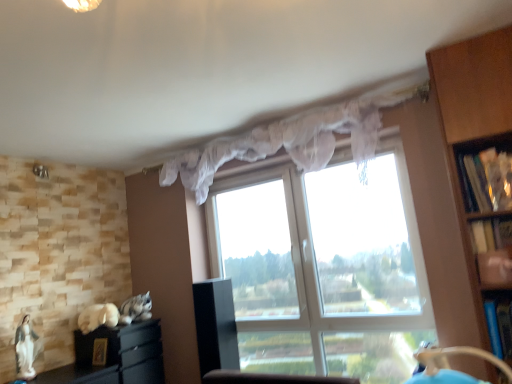
In order to face translucent fabric curtain at upper center, should I rotate leftwards or rightwards?

To align with it, rotate right about 0.863°.

This screenshot has height=384, width=512. Describe the element at coordinates (125, 350) in the screenshot. I see `black matte cabinet at lower left, the 1th cabinetry from the left` at that location.

What do you see at coordinates (136, 309) in the screenshot? I see `fluffy gray cat at lower left, arranged as the first animal when viewed from the right` at bounding box center [136, 309].

This screenshot has width=512, height=384. I want to click on white fur cat at lower left, which is the 1th animal from left to right, so click(x=98, y=317).

What do you see at coordinates (495, 267) in the screenshot? I see `wooden bookshelf at right, which is counted as the 2th shelf, starting from the top` at bounding box center [495, 267].

Locate an element on the screen. This screenshot has height=384, width=512. black glossy cabinet at center, the second cabinetry in the left-to-right sequence is located at coordinates (215, 325).

Does blue plastic shelf at right, positioned as the third shelf in top-to-bottom order, turn towards translucent fabric curtain at upper center?

No, blue plastic shelf at right, positioned as the third shelf in top-to-bottom order, is not aimed at translucent fabric curtain at upper center.

Is point (503, 332) positioned after point (205, 193)?

No.

From a real-world perspective, which object stands above the other?

From a 3D spatial view, translucent fabric curtain at upper center is above.

Which is less distant, (490, 333) or (362, 276)?

Point (490, 333) is closer to the camera than point (362, 276).

Does blue plastic shelf at right, which is counted as the 1th shelf, starting from the bottom, appear on the right side of transparent fabric window at center?

Indeed, blue plastic shelf at right, which is counted as the 1th shelf, starting from the bottom, is positioned on the right side of transparent fabric window at center.

Who is bigger, blue plastic shelf at right, which is counted as the 1th shelf, starting from the bottom, or transparent fabric window at center?

transparent fabric window at center.

How different are the orientations of blue plastic shelf at right, positioned as the third shelf in top-to-bottom order, and transparent fabric window at center in degrees?

1.2 degrees separate the facing orientations of blue plastic shelf at right, positioned as the third shelf in top-to-bottom order, and transparent fabric window at center.

From the image's perspective, would you say translucent fabric curtain at upper center is positioned over wooden bookshelf at right, which appears as the first shelf when viewed from the top?

Yes, from the image's perspective, translucent fabric curtain at upper center is above wooden bookshelf at right, which appears as the first shelf when viewed from the top.

What's the angular difference between translucent fabric curtain at upper center and wooden bookshelf at right, marked as the third shelf in a bottom-to-top arrangement,'s facing directions?

There is a 2.56-degree angle between the facing directions of translucent fabric curtain at upper center and wooden bookshelf at right, marked as the third shelf in a bottom-to-top arrangement.

From a real-world perspective, which is physically above, translucent fabric curtain at upper center or wooden bookshelf at right, marked as the third shelf in a bottom-to-top arrangement?

In real-world perspective, translucent fabric curtain at upper center is above.

The width and height of the screenshot is (512, 384). What are the coordinates of `shelf that is the 1st one when counting downward from the translucent fabric curtain at upper center (from the image's perspective)` in the screenshot? It's located at (490, 234).

From the image's perspective, is wooden bookshelf at right, which appears as the first shelf when viewed from the top, located above translucent fabric curtain at upper center?

No.

Looking at this image, does wooden bookshelf at right, which appears as the first shelf when viewed from the top, have a smaller size compared to translucent fabric curtain at upper center?

Yes, wooden bookshelf at right, which appears as the first shelf when viewed from the top, is smaller than translucent fabric curtain at upper center.

In the scene shown: From a real-world perspective, is wooden bookshelf at right, which appears as the first shelf when viewed from the top, under translucent fabric curtain at upper center?

Yes, from a real-world perspective, wooden bookshelf at right, which appears as the first shelf when viewed from the top, is below translucent fabric curtain at upper center.

Is the position of wooden bookshelf at right, which appears as the first shelf when viewed from the top, more distant than that of translucent fabric curtain at upper center?

No, wooden bookshelf at right, which appears as the first shelf when viewed from the top, is in front of translucent fabric curtain at upper center.

Is wooden bookshelf at right, marked as the third shelf in a bottom-to-top arrangement, touching black glossy cabinet at center, the second cabinetry in the left-to-right sequence?

No, wooden bookshelf at right, marked as the third shelf in a bottom-to-top arrangement, is not making contact with black glossy cabinet at center, the second cabinetry in the left-to-right sequence.

From the image's perspective, is wooden bookshelf at right, marked as the third shelf in a bottom-to-top arrangement, above or below black glossy cabinet at center, the second cabinetry in the left-to-right sequence?

From the image's perspective, wooden bookshelf at right, marked as the third shelf in a bottom-to-top arrangement, appears above black glossy cabinet at center, the second cabinetry in the left-to-right sequence.

From a real-world perspective, which object rests below the other?

black glossy cabinet at center, the second cabinetry in the left-to-right sequence, is physically lower.

Which of these two, wooden bookshelf at right, which appears as the first shelf when viewed from the top, or black glossy cabinet at center, the second cabinetry in the left-to-right sequence, is bigger?

Bigger between the two is black glossy cabinet at center, the second cabinetry in the left-to-right sequence.

Is wooden bookshelf at right, which is counted as the 2th shelf, starting from the top, spatially inside wooden bookshelf at right, marked as the third shelf in a bottom-to-top arrangement, or outside of it?

wooden bookshelf at right, which is counted as the 2th shelf, starting from the top, is located beyond the bounds of wooden bookshelf at right, marked as the third shelf in a bottom-to-top arrangement.

Between wooden bookshelf at right, which is counted as the 2th shelf, starting from the top, and wooden bookshelf at right, which appears as the first shelf when viewed from the top, which one has larger size?

Bigger between the two is wooden bookshelf at right, which appears as the first shelf when viewed from the top.

Between wooden bookshelf at right, the second shelf from the bottom, and wooden bookshelf at right, marked as the third shelf in a bottom-to-top arrangement, which one is positioned in front?

Positioned in front is wooden bookshelf at right, the second shelf from the bottom.

How distant is wooden bookshelf at right, the second shelf from the bottom, from wooden bookshelf at right, which appears as the first shelf when viewed from the top?

The distance of wooden bookshelf at right, the second shelf from the bottom, from wooden bookshelf at right, which appears as the first shelf when viewed from the top, is 5.05 inches.

Considering the points (252, 307) and (355, 139), which point is behind, point (252, 307) or point (355, 139)?

The point (252, 307) is farther from the camera.

Can you confirm if transparent fabric window at center is thinner than translucent fabric curtain at upper center?

No.

Is transparent fabric window at center oriented towards translucent fabric curtain at upper center?

Yes, transparent fabric window at center is oriented towards translucent fabric curtain at upper center.

From a real-world perspective, which is physically below, transparent fabric window at center or translucent fabric curtain at upper center?

transparent fabric window at center, from a real-world perspective.

From a real-world perspective, which shelf is the 3rd one underneath the translucent fabric curtain at upper center? Please provide its 2D coordinates.

[(499, 324)]

In the image, there is a transparent fabric window at center. At what (x,y) coordinates should I click in order to perform the action: click on shelf below it (from the image's perspective). Please return your answer as a coordinate pair (x, y). Looking at the image, I should click on (499, 324).

When comparing their distances from blue plastic shelf at right, positioned as the third shelf in top-to-bottom order, does wooden bookshelf at right, the second shelf from the bottom, or white fur cat at lower left, which is the 1th animal from left to right, seem closer?

wooden bookshelf at right, the second shelf from the bottom, is positioned closer to the anchor blue plastic shelf at right, positioned as the third shelf in top-to-bottom order.

Which object lies nearer to the anchor point black matte cabinet at lower left, the 2th cabinetry from the right, translucent fabric curtain at upper center or transparent fabric window at center?

Among the two, transparent fabric window at center is located nearer to black matte cabinet at lower left, the 2th cabinetry from the right.

Estimate the real-world distances between objects in this image. Which object is closer to wooden bookshelf at right, the second shelf from the bottom, black glossy cabinet at center, the second cabinetry in the left-to-right sequence, or white fur cat at lower left, which is the 1th animal from left to right?

black glossy cabinet at center, the second cabinetry in the left-to-right sequence.

Based on their spatial positions, is fluffy gray cat at lower left, which appears as the 2th animal when viewed from the left, or blue plastic shelf at right, which is counted as the 1th shelf, starting from the bottom, further from wooden bookshelf at right, the second shelf from the bottom?

fluffy gray cat at lower left, which appears as the 2th animal when viewed from the left, is positioned further to the anchor wooden bookshelf at right, the second shelf from the bottom.

Which object lies further to the anchor point black matte cabinet at lower left, the 2th cabinetry from the right, wooden bookshelf at right, which appears as the first shelf when viewed from the top, or translucent fabric curtain at upper center?

Based on the image, wooden bookshelf at right, which appears as the first shelf when viewed from the top, appears to be further to black matte cabinet at lower left, the 2th cabinetry from the right.

Based on their spatial positions, is wooden bookshelf at right, which is counted as the 2th shelf, starting from the top, or translucent fabric curtain at upper center closer to blue plastic shelf at right, which is counted as the 1th shelf, starting from the bottom?

wooden bookshelf at right, which is counted as the 2th shelf, starting from the top.

Based on their spatial positions, is fluffy gray cat at lower left, which appears as the 2th animal when viewed from the left, or wooden bookshelf at right, marked as the third shelf in a bottom-to-top arrangement, further from wooden bookshelf at right, the second shelf from the bottom?

The object further to wooden bookshelf at right, the second shelf from the bottom, is fluffy gray cat at lower left, which appears as the 2th animal when viewed from the left.

Considering their positions, is fluffy gray cat at lower left, arranged as the first animal when viewed from the right, positioned further to transparent fabric window at center than blue plastic shelf at right, positioned as the third shelf in top-to-bottom order?

The object further to transparent fabric window at center is fluffy gray cat at lower left, arranged as the first animal when viewed from the right.

At what (x,y) coordinates should I click in order to perform the action: click on curtain between white fur cat at lower left, which appears as the second animal when viewed from the right, and wooden bookshelf at right, which appears as the first shelf when viewed from the top. Please return your answer as a coordinate pair (x, y). Looking at the image, I should click on (282, 145).

This screenshot has height=384, width=512. I want to click on curtain between white fur cat at lower left, which is the 1th animal from left to right, and wooden bookshelf at right, which is counted as the 2th shelf, starting from the top, in the horizontal direction, so click(282, 145).

Where is `cabinetry between black matte cabinet at lower left, the 1th cabinetry from the left, and blue plastic shelf at right, which is counted as the 1th shelf, starting from the bottom, in the horizontal direction`? cabinetry between black matte cabinet at lower left, the 1th cabinetry from the left, and blue plastic shelf at right, which is counted as the 1th shelf, starting from the bottom, in the horizontal direction is located at coordinates (215, 325).

The width and height of the screenshot is (512, 384). I want to click on cabinetry between black matte cabinet at lower left, the 1th cabinetry from the left, and wooden bookshelf at right, the second shelf from the bottom, so [215, 325].